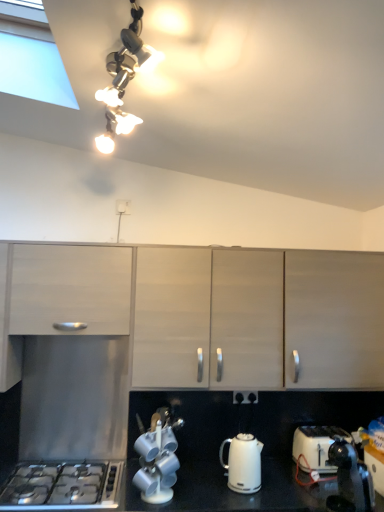
The height and width of the screenshot is (512, 384). Find the location of `vacant space situated above stainless steel gas stove at lower left (from a real-world perspective)`. vacant space situated above stainless steel gas stove at lower left (from a real-world perspective) is located at coordinates (61, 481).